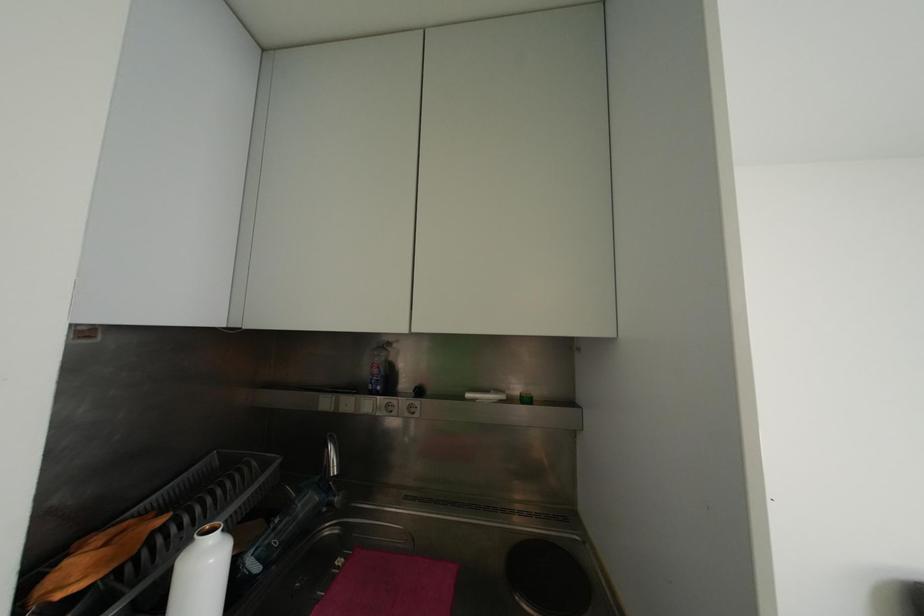
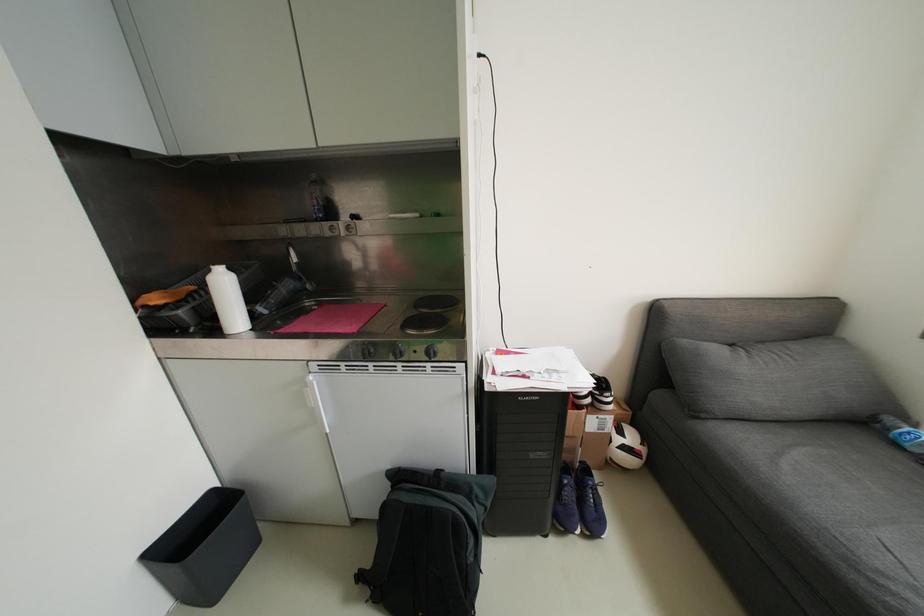
Question: How did the camera likely rotate?

Choices:
 (A) Left
 (B) Right
 (C) Up
 (D) Down

Answer: (D)